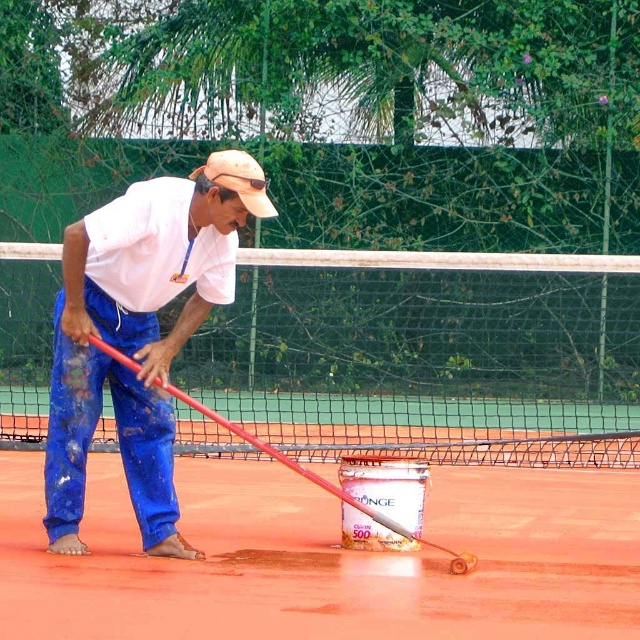
Which of these two, blue cotton pants at center or tan fabric baseball cap at center, stands shorter?

Standing shorter between the two is tan fabric baseball cap at center.

Is blue cotton pants at center in front of tan fabric baseball cap at center?

No.

In order to click on blue cotton pants at center in this screenshot , I will do `click(138, 332)`.

Can you confirm if smooth clay surface at center is thinner than blue cotton pants at center?

In fact, smooth clay surface at center might be wider than blue cotton pants at center.

Does smooth clay surface at center have a smaller size compared to blue cotton pants at center?

Indeed, smooth clay surface at center has a smaller size compared to blue cotton pants at center.

Where is `smooth clay surface at center`? The height and width of the screenshot is (640, 640). smooth clay surface at center is located at coordinates (326, 557).

Can you confirm if white mesh tennis net at center is smaller than tan fabric baseball cap at center?

No.

Does point (292, 337) come behind point (237, 180)?

Yes, point (292, 337) is farther from viewer.

Does point (20, 264) come in front of point (234, 150)?

No, (20, 264) is behind (234, 150).

Locate an element on the screen. The width and height of the screenshot is (640, 640). white mesh tennis net at center is located at coordinates (429, 355).